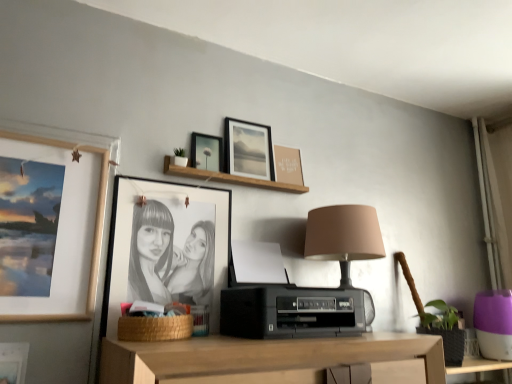
Question: Is woven brown basket at lower center taller or shorter than black matte picture frame at center, which appears as the fourth picture frame when viewed from the right?

Choices:
 (A) short
 (B) tall

Answer: (A)

Question: Is woven brown basket at lower center situated inside black matte picture frame at center, marked as the third picture frame in a left-to-right arrangement, or outside?

Choices:
 (A) outside
 (B) inside

Answer: (A)

Question: Which of these objects is positioned closest to the matte wooden picture frame at left, which appears as the fifth picture frame when viewed from the right?

Choices:
 (A) matte brown picture frame at upper center, which is counted as the sixth picture frame, starting from the left
 (B) matte black picture frame at upper center, which is counted as the 2th picture frame, starting from the right
 (C) wooden shelf at upper center
 (D) black matte picture frame at center, marked as the third picture frame in a left-to-right arrangement
 (E) woven brown basket at lower center

Answer: (D)

Question: Considering the real-world distances, which object is farthest from the black matte picture frame at center, which appears as the fourth picture frame when viewed from the right?

Choices:
 (A) woven brown basket at lower center
 (B) matte black picture frame at upper center, the 4th picture frame from the left
 (C) matte wooden picture frame at left, which appears as the fifth picture frame when viewed from the right
 (D) matte brown picture frame at upper center, which appears as the 1th picture frame when viewed from the right
 (E) matte black picture frame at upper center, which is counted as the 2th picture frame, starting from the right

Answer: (D)